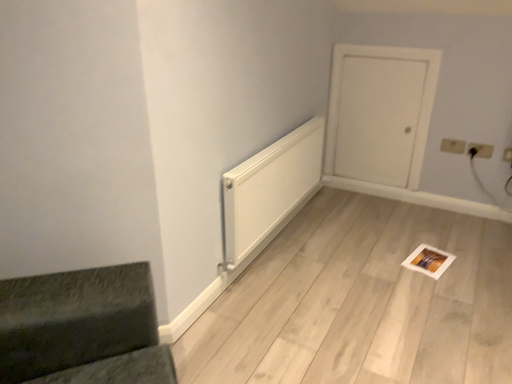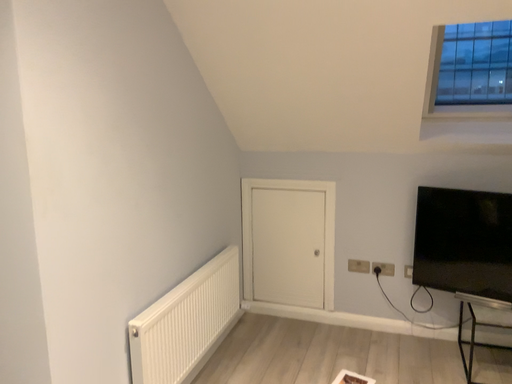
Question: How did the camera likely rotate when shooting the video?

Choices:
 (A) rotated left
 (B) rotated right

Answer: (B)